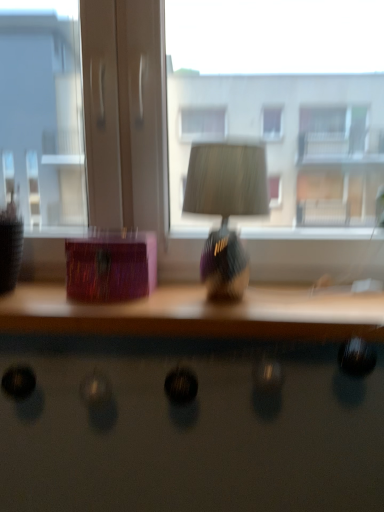
Describe the element at coordinates (201, 314) in the screenshot. I see `wooden table at center` at that location.

What do you see at coordinates (191, 403) in the screenshot? I see `shiny black desk at lower center` at bounding box center [191, 403].

The height and width of the screenshot is (512, 384). Describe the element at coordinates (226, 207) in the screenshot. I see `shiny purple lampshade at center` at that location.

Identify the location of wooden table at center. (201, 314).

Is shiny purple lampshade at center smaller than wooden table at center?

Indeed, shiny purple lampshade at center has a smaller size compared to wooden table at center.

Considering the relative sizes of shiny purple lampshade at center and wooden table at center in the image provided, is shiny purple lampshade at center shorter than wooden table at center?

Incorrect, the height of shiny purple lampshade at center does not fall short of that of wooden table at center.

From a real-world perspective, is shiny purple lampshade at center positioned under wooden table at center based on gravity?

No, from a real-world perspective, shiny purple lampshade at center is not below wooden table at center.

Is shiny purple lampshade at center oriented away from wooden table at center?

shiny purple lampshade at center is not turned away from wooden table at center.

From the image's perspective, does transparent glass window at center appear lower than wooden table at center?

Actually, transparent glass window at center appears above wooden table at center in the image.

How many degrees apart are the facing directions of transparent glass window at center and wooden table at center?

0.511 degrees separate the facing orientations of transparent glass window at center and wooden table at center.

Which is behind, transparent glass window at center or wooden table at center?

transparent glass window at center.

How different are the orientations of wooden table at center and shiny purple lampshade at center in degrees?

wooden table at center and shiny purple lampshade at center are facing 3.46 degrees away from each other.

How distant is wooden table at center from shiny purple lampshade at center?

6.78 inches.

In the image, is wooden table at center on the left side or the right side of shiny purple lampshade at center?

Clearly, wooden table at center is on the left of shiny purple lampshade at center in the image.

Could you tell me if wooden table at center is facing shiny purple lampshade at center?

No, wooden table at center is not turned towards shiny purple lampshade at center.

Considering the relative sizes of transparent glass window at center and shiny black desk at lower center in the image provided, is transparent glass window at center taller than shiny black desk at lower center?

Correct, transparent glass window at center is much taller as shiny black desk at lower center.

From the image's perspective, is transparent glass window at center positioned above or below shiny black desk at lower center?

transparent glass window at center is situated higher than shiny black desk at lower center in the image.

Is point (103, 157) less distant than point (274, 322)?

No, (103, 157) is behind (274, 322).

From the picture: Who is bigger, transparent glass window at center or shiny black desk at lower center?

transparent glass window at center.

How far apart are shiny purple lampshade at center and transparent glass window at center?

shiny purple lampshade at center is 11.02 inches away from transparent glass window at center.

Is shiny purple lampshade at center surrounding transparent glass window at center?

No, transparent glass window at center is not a part of shiny purple lampshade at center.

Considering their positions, is shiny purple lampshade at center located in front of or behind transparent glass window at center?

Clearly, shiny purple lampshade at center is in front of transparent glass window at center.

Which is closer, (222,168) or (345,118)?

Point (222,168) is positioned closer to the camera compared to point (345,118).

Does point (125, 325) come in front of point (290, 247)?

That is True.

Is the depth of shiny black desk at lower center greater than that of transparent glass window at center?

No, shiny black desk at lower center is in front of transparent glass window at center.

Are shiny black desk at lower center and transparent glass window at center beside each other?

They are not placed beside each other.

Which of these two, shiny black desk at lower center or transparent glass window at center, stands shorter?

shiny black desk at lower center is shorter.

From the picture: From a real-world perspective, is wooden table at center positioned above or below shiny black desk at lower center?

From a real-world perspective, wooden table at center is physically above shiny black desk at lower center.

Does wooden table at center lie behind shiny black desk at lower center?

Yes, it is behind shiny black desk at lower center.

How many degrees apart are the facing directions of wooden table at center and shiny black desk at lower center?

They differ by 0.443 degrees in their facing directions.

How much distance is there between wooden table at center and shiny black desk at lower center?

wooden table at center is 13.43 centimeters away from shiny black desk at lower center.

Where is `table lamp on the right of the wooden table at center`? The height and width of the screenshot is (512, 384). table lamp on the right of the wooden table at center is located at coordinates (226, 207).

Identify the location of window located above the wooden table at center (from a real-world perspective). (235, 136).

Based on their spatial positions, is shiny black desk at lower center or transparent glass window at center closer to shiny purple lampshade at center?

shiny black desk at lower center is closer to shiny purple lampshade at center.

Considering their positions, is transparent glass window at center positioned closer to shiny purple lampshade at center than wooden table at center?

wooden table at center.

In the scene shown: From the image, which object appears to be farther from shiny purple lampshade at center, wooden table at center or transparent glass window at center?

Based on the image, transparent glass window at center appears to be further to shiny purple lampshade at center.

From the image, which object appears to be farther from shiny black desk at lower center, wooden table at center or shiny purple lampshade at center?

shiny purple lampshade at center lies further to shiny black desk at lower center than the other object.

Estimate the real-world distances between objects in this image. Which object is further from transparent glass window at center, wooden table at center or shiny purple lampshade at center?

The object further to transparent glass window at center is wooden table at center.

Estimate the real-world distances between objects in this image. Which object is further from shiny black desk at lower center, wooden table at center or transparent glass window at center?

transparent glass window at center.

From the image, which object appears to be farther from wooden table at center, shiny purple lampshade at center or shiny black desk at lower center?

shiny purple lampshade at center lies further to wooden table at center than the other object.

Based on their spatial positions, is shiny black desk at lower center or shiny purple lampshade at center closer to wooden table at center?

The object closer to wooden table at center is shiny black desk at lower center.

At what (x,y) coordinates should I click in order to perform the action: click on table lamp between transparent glass window at center and wooden table at center vertically. Please return your answer as a coordinate pair (x, y). Looking at the image, I should click on (226, 207).

Locate an element on the screen. This screenshot has width=384, height=512. table between shiny purple lampshade at center and shiny black desk at lower center vertically is located at coordinates (201, 314).

This screenshot has width=384, height=512. I want to click on table between transparent glass window at center and shiny black desk at lower center in the up-down direction, so click(x=201, y=314).

Locate an element on the screen. This screenshot has height=512, width=384. table lamp between transparent glass window at center and shiny black desk at lower center in the up-down direction is located at coordinates (226, 207).